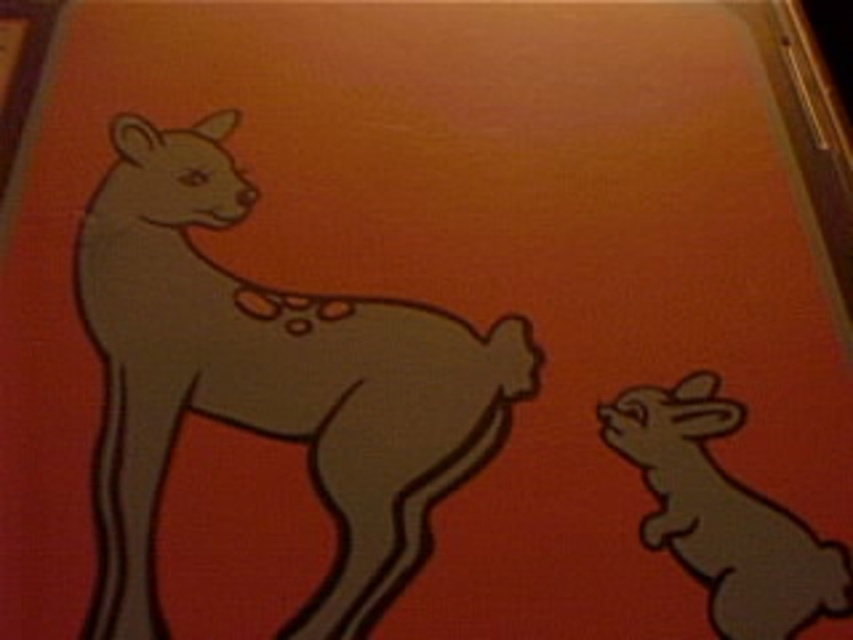
Is matte brown kangaroo at left smaller than matte gray rabbit at lower right?

No, matte brown kangaroo at left is not smaller than matte gray rabbit at lower right.

Who is taller, matte brown kangaroo at left or matte gray rabbit at lower right?

matte brown kangaroo at left is taller.

Locate an element on the screen. The image size is (853, 640). matte brown kangaroo at left is located at coordinates (270, 381).